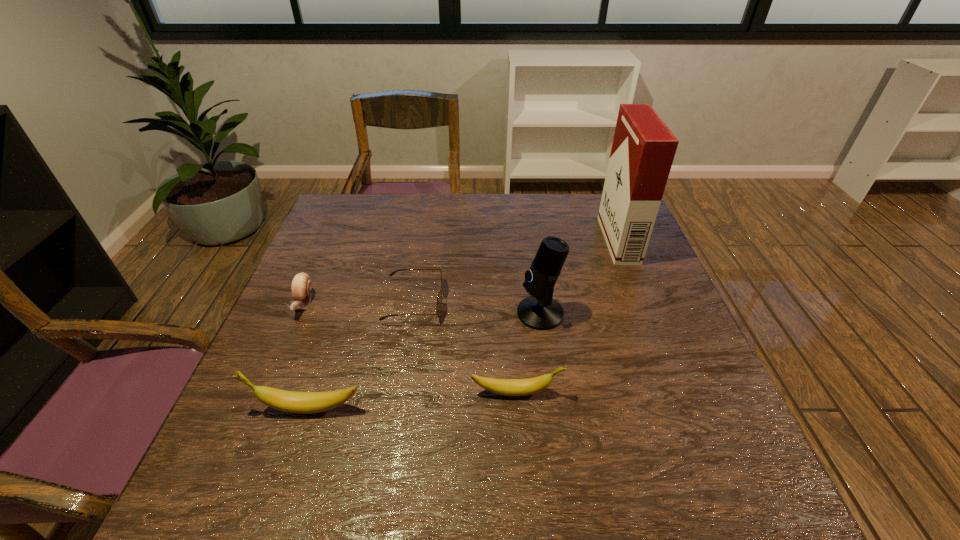
What are the coordinates of `banana positioned at the left edge` in the screenshot? It's located at (288, 401).

You are a GUI agent. You are given a task and a screenshot of the screen. Output one action in this format:
    pyautogui.click(x=<x>, y=<y>)
    Task: Click on the escargot that is at the left edge
    The image size is (960, 540).
    Given the screenshot: What is the action you would take?
    pyautogui.click(x=301, y=287)

The height and width of the screenshot is (540, 960). I want to click on object present at the right edge, so click(643, 149).

Identify the location of object located in the near left corner section of the desktop. (288, 401).

Locate an element on the screen. This screenshot has width=960, height=540. object that is positioned at the far right corner is located at coordinates (643, 149).

Locate an element on the screen. This screenshot has width=960, height=540. blank area at the far edge is located at coordinates (558, 226).

Locate an element on the screen. The width and height of the screenshot is (960, 540). blank space at the near edge of the desktop is located at coordinates (569, 415).

Where is `vacant region at the left edge of the desktop`? This screenshot has height=540, width=960. vacant region at the left edge of the desktop is located at coordinates (247, 396).

Image resolution: width=960 pixels, height=540 pixels. In the image, there is a desktop. Identify the location of vacant space at the right edge. (599, 238).

Find the location of a particular element. vacant space at the far left corner of the desktop is located at coordinates (352, 228).